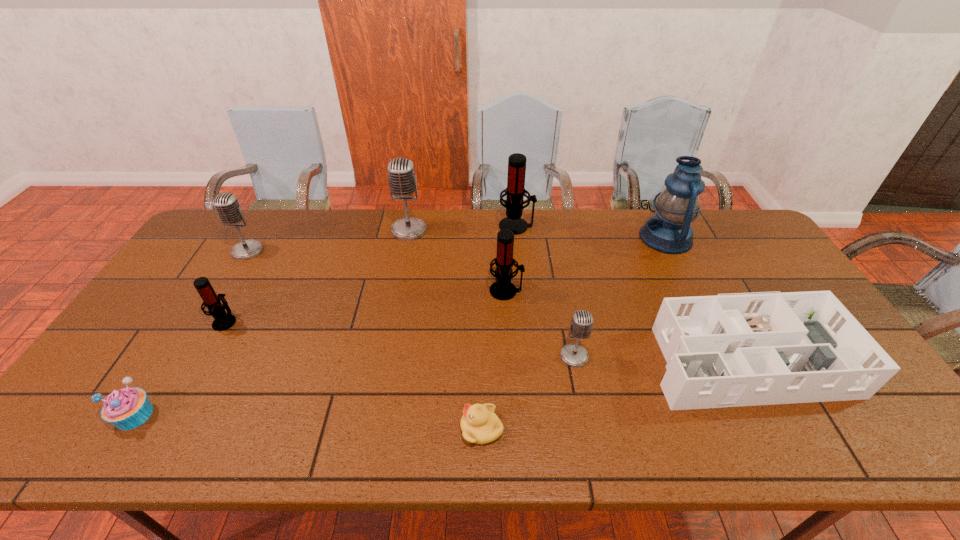
Where is `the rightmost gray microphone`? the rightmost gray microphone is located at coordinates (574, 355).

Identify the location of the nearest microphone. 574,355.

You are a GUI agent. You are given a task and a screenshot of the screen. Output one action in this format:
    pyautogui.click(x=<x>, y=<y>)
    Task: Click on the third shortest object
    The width and height of the screenshot is (960, 540).
    Given the screenshot: What is the action you would take?
    pyautogui.click(x=750, y=349)

At what (x,y) coordinates should I click in order to perform the action: click on the second shortest object. Please return your answer as a coordinate pair (x, y). The height and width of the screenshot is (540, 960). Looking at the image, I should click on (127, 408).

Where is `blue muffin`? The image size is (960, 540). blue muffin is located at coordinates (127, 408).

Locate an element on the screen. The image size is (960, 540). yellow duckling is located at coordinates (479, 424).

You are a GUI agent. You are given a task and a screenshot of the screen. Output one action in this format:
    pyautogui.click(x=<x>, y=<y>)
    Task: Click on the duckling
    The height and width of the screenshot is (540, 960).
    Given the screenshot: What is the action you would take?
    pyautogui.click(x=479, y=424)

Identify the location of free space located on the face of the blue lantern. (546, 238).

Identify the location of vacant area situated on the face of the blue lantern. (602, 238).

The image size is (960, 540). Find the location of `blank space located 0.160m on the face of the blue lantern`. blank space located 0.160m on the face of the blue lantern is located at coordinates (593, 238).